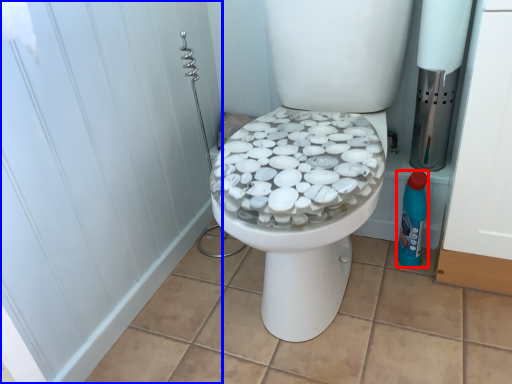
Question: Which object is further to the camera taking this photo, cleaning product (highlighted by a red box) or screen door (highlighted by a blue box)?

Choices:
 (A) cleaning product
 (B) screen door

Answer: (A)